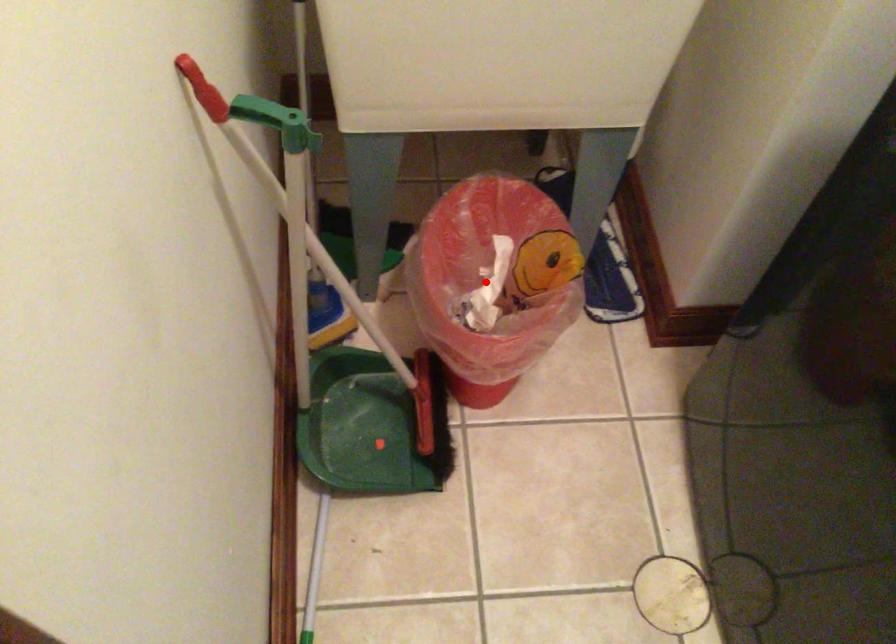
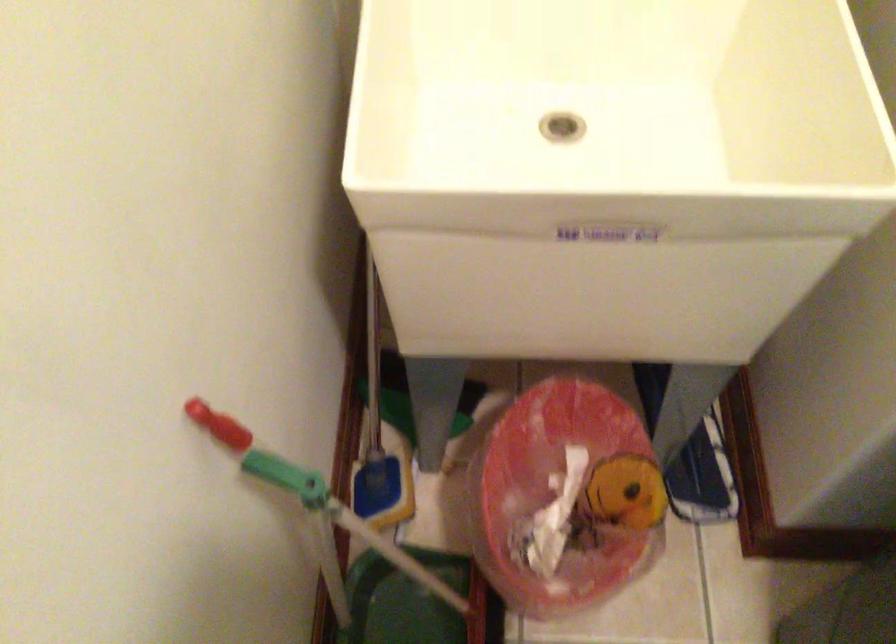
The point at the highlighted location is marked in the first image. Where is the corresponding point in the second image?

(555, 496)